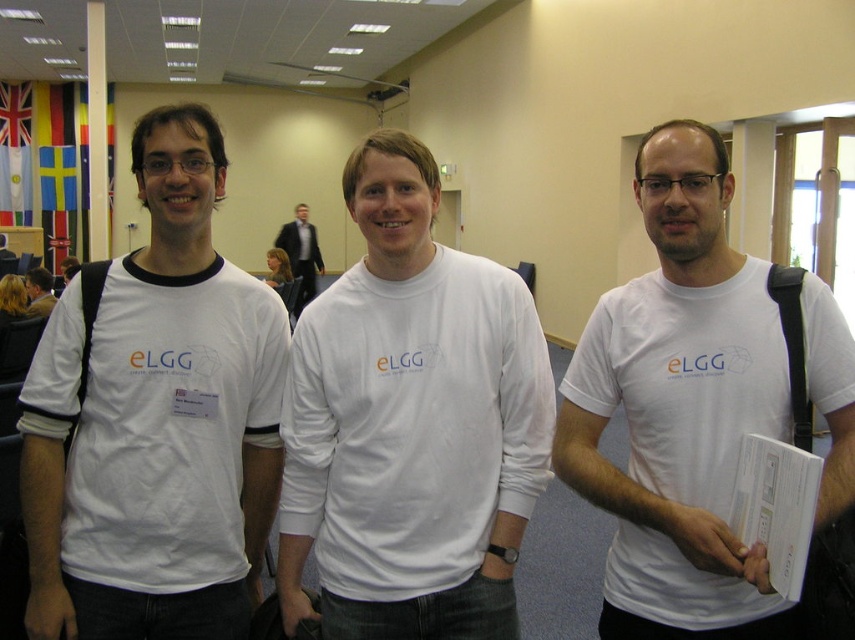
Between white cotton t-shirt at left and white paper folder at center, which one has more height?

white cotton t-shirt at left is taller.

Describe the element at coordinates (156, 420) in the screenshot. I see `white cotton t-shirt at left` at that location.

Image resolution: width=855 pixels, height=640 pixels. What do you see at coordinates (156, 420) in the screenshot?
I see `white cotton t-shirt at left` at bounding box center [156, 420].

Locate an element on the screen. white cotton t-shirt at left is located at coordinates (156, 420).

Who is shorter, white paper folder at center or matte white t-shirt at center?

Standing shorter between the two is white paper folder at center.

Measure the distance from white paper folder at center to matte white t-shirt at center.

They are 4.89 meters apart.

This screenshot has height=640, width=855. What do you see at coordinates (776, 508) in the screenshot?
I see `white paper folder at center` at bounding box center [776, 508].

The width and height of the screenshot is (855, 640). What are the coordinates of `white paper folder at center` in the screenshot? It's located at (776, 508).

Can you confirm if white matte t-shirt at center is wider than white paper folder at center?

Yes.

Does white matte t-shirt at center have a larger size compared to white paper folder at center?

Indeed, white matte t-shirt at center has a larger size compared to white paper folder at center.

Image resolution: width=855 pixels, height=640 pixels. I want to click on white matte t-shirt at center, so click(699, 406).